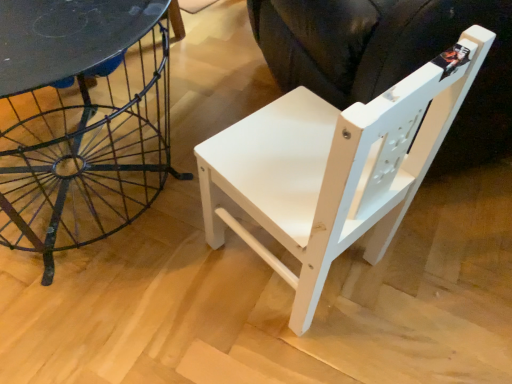
Question: Is white matte wood swivel chair at center at the left side of matte black table at left?

Choices:
 (A) yes
 (B) no

Answer: (B)

Question: Is white matte wood swivel chair at center not near matte black table at left?

Choices:
 (A) yes
 (B) no

Answer: (B)

Question: Can you confirm if white matte wood swivel chair at center is bigger than matte black table at left?

Choices:
 (A) yes
 (B) no

Answer: (A)

Question: Is matte black table at left at the back of white matte wood swivel chair at center?

Choices:
 (A) yes
 (B) no

Answer: (B)

Question: Considering the relative sizes of white matte wood swivel chair at center and matte black table at left in the image provided, is white matte wood swivel chair at center taller than matte black table at left?

Choices:
 (A) no
 (B) yes

Answer: (B)

Question: From a real-world perspective, does white matte wood swivel chair at center stand above matte black table at left?

Choices:
 (A) yes
 (B) no

Answer: (A)

Question: Is metallic black table at left positioned before white matte wood chair at center?

Choices:
 (A) yes
 (B) no

Answer: (B)

Question: Does metallic black table at left turn towards white matte wood chair at center?

Choices:
 (A) yes
 (B) no

Answer: (B)

Question: Can you confirm if metallic black table at left is wider than white matte wood chair at center?

Choices:
 (A) yes
 (B) no

Answer: (A)

Question: Is metallic black table at left outside of white matte wood chair at center?

Choices:
 (A) yes
 (B) no

Answer: (A)

Question: Is metallic black table at left beside white matte wood chair at center?

Choices:
 (A) yes
 (B) no

Answer: (B)

Question: From the image's perspective, is metallic black table at left below white matte wood chair at center?

Choices:
 (A) no
 (B) yes

Answer: (A)

Question: Considering the relative sizes of matte black table at left and white matte wood swivel chair at center in the image provided, is matte black table at left thinner than white matte wood swivel chair at center?

Choices:
 (A) yes
 (B) no

Answer: (A)